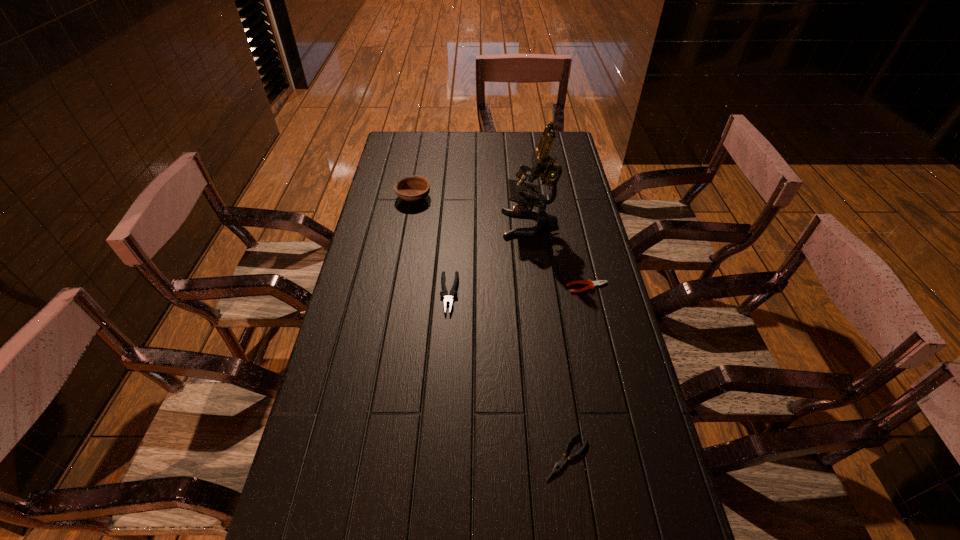
Locate an element on the screen. Image resolution: width=960 pixels, height=540 pixels. empty space between the tallest pliers and the microscope is located at coordinates (490, 259).

The width and height of the screenshot is (960, 540). Identify the location of object that stands as the fourth closest to the second object from left to right. (558, 466).

The image size is (960, 540). What are the coordinates of `the closest object to the fourth nearest object` in the screenshot? It's located at (592, 284).

Image resolution: width=960 pixels, height=540 pixels. What are the coordinates of `the closest pliers to the tallest object` in the screenshot? It's located at (592, 284).

Find the location of a particular element. pliers identified as the closest to the fourth object from right to left is located at coordinates (592, 284).

This screenshot has width=960, height=540. Find the location of `free location that satisfies the following two spatial constraints: 1. at the eyepieces of the rightmost pliers; 2. on the right side of the second farthest object`. free location that satisfies the following two spatial constraints: 1. at the eyepieces of the rightmost pliers; 2. on the right side of the second farthest object is located at coordinates (538, 287).

Locate an element on the screen. free space that satisfies the following two spatial constraints: 1. at the eyepieces of the fourth nearest object; 2. on the back side of the second pliers from right to left is located at coordinates (559, 457).

Image resolution: width=960 pixels, height=540 pixels. In order to click on vacant point that satisfies the following two spatial constraints: 1. at the eyepieces of the tallest object; 2. on the left side of the nearest object in this screenshot , I will do `click(559, 457)`.

The image size is (960, 540). I want to click on vacant space that satisfies the following two spatial constraints: 1. at the eyepieces of the second pliers from right to left; 2. on the right side of the tallest object, so click(x=559, y=457).

Image resolution: width=960 pixels, height=540 pixels. I want to click on free space that satisfies the following two spatial constraints: 1. at the eyepieces of the fourth nearest object; 2. on the right side of the nearest object, so click(x=559, y=457).